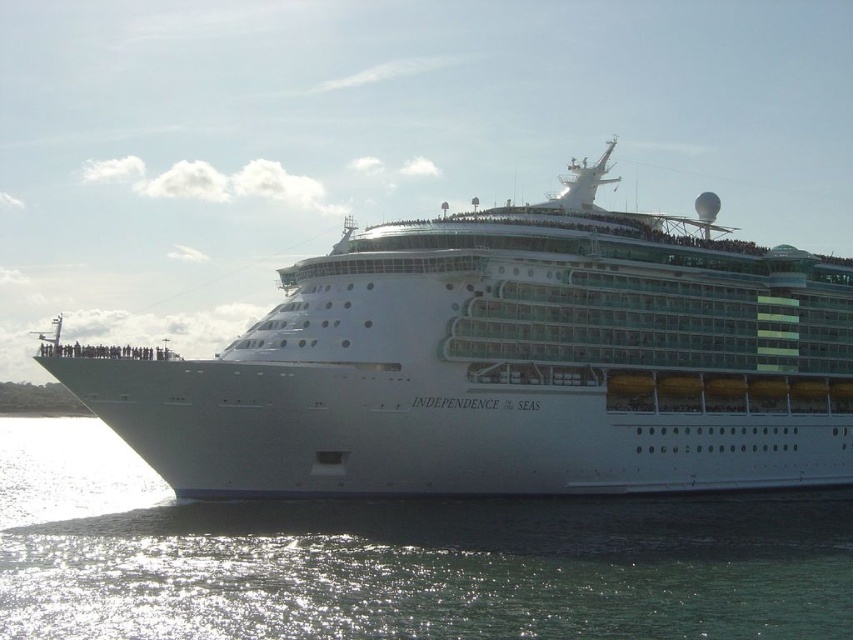
You are standing on a pier and looking at the white glossy cruise ship at center and the clear water at lower left. Which object is closer to you?

The white glossy cruise ship at center is closer to you than the clear water at lower left because it is further to the viewer.

You are standing on the cruise ship Independence of the Seas and want to locate two specific points on its deck. The first point is at coordinates point (770, 269) and the second is at point (248, 627). Based on your current position, which point is closer to the ship bow?

Point (248, 627) is closer to the ship bow because it is in front of point (770, 269).